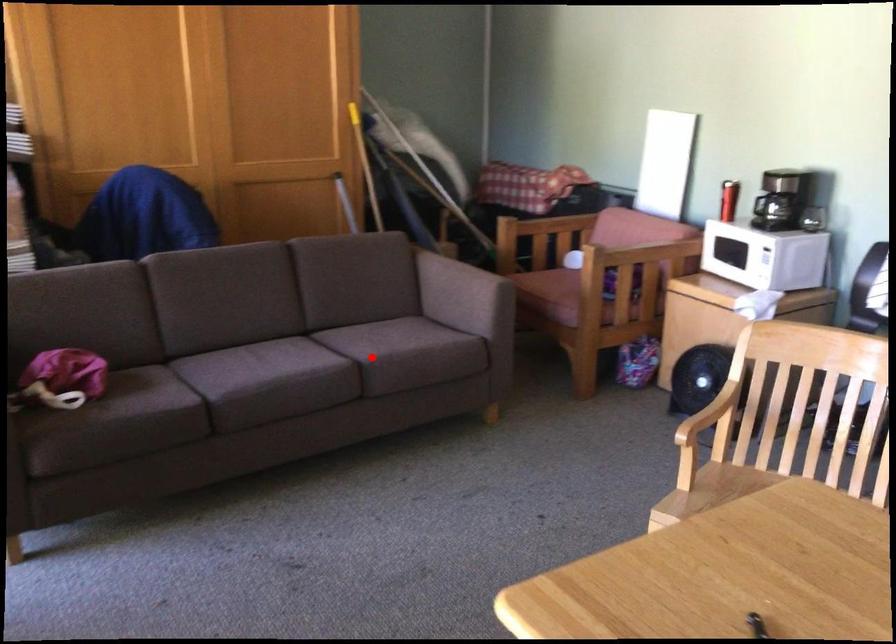
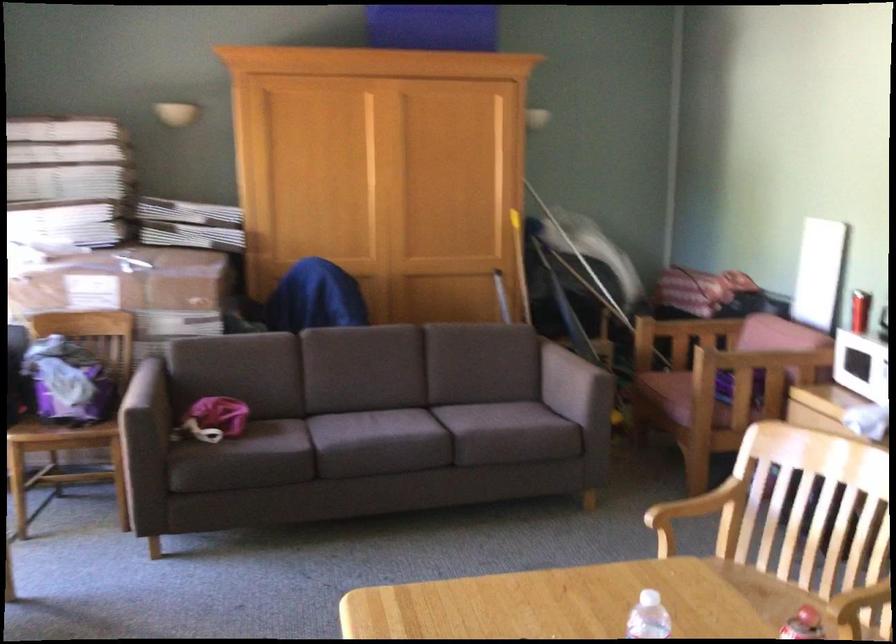
Find the pixel in the second image that matches the highlighted location in the first image.

(467, 430)